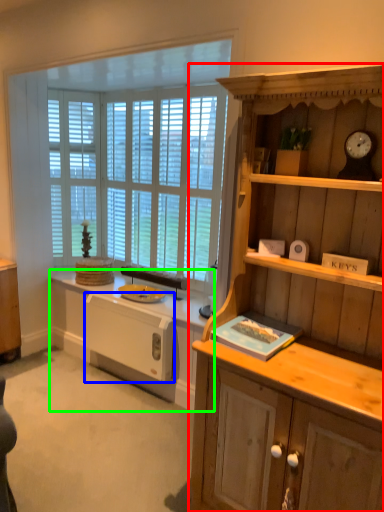
Question: Estimate the real-world distances between objects in this image. Which object is farther from cabinetry (highlighted by a red box), appliance (highlighted by a blue box) or countertop (highlighted by a green box)?

Choices:
 (A) appliance
 (B) countertop

Answer: (A)